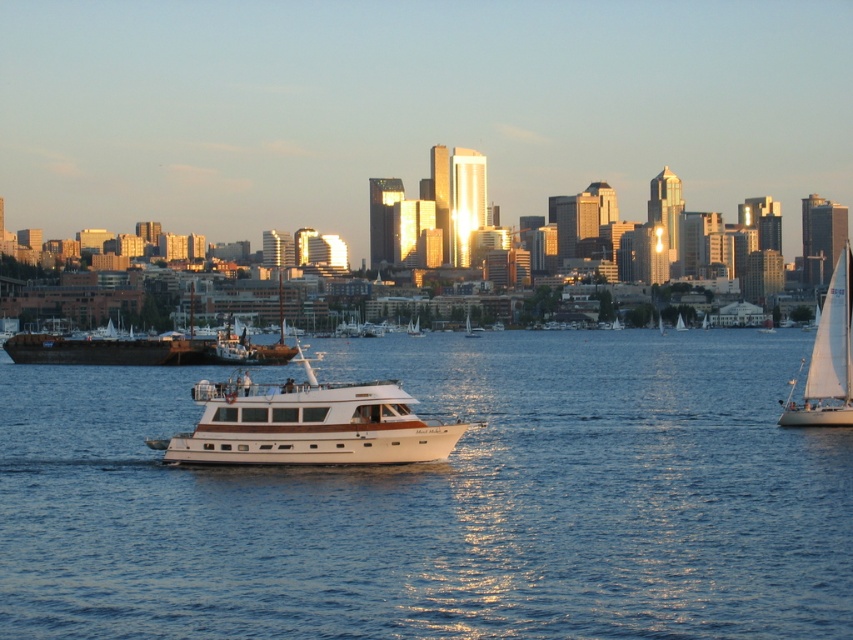
Who is more distant from viewer, (x=310, y=424) or (x=843, y=314)?

The point (x=843, y=314) is more distant.

Who is more forward, (297, 397) or (791, 424)?

Positioned in front is point (297, 397).

Is point (300, 362) less distant than point (809, 422)?

No, (300, 362) is further to viewer.

Where is `white polished wood boat at center`? The width and height of the screenshot is (853, 640). white polished wood boat at center is located at coordinates (308, 422).

Between blue water at center and white sailboat at center, which one is positioned higher?

white sailboat at center is above.

Is blue water at center taller than white sailboat at center?

Indeed, blue water at center has a greater height compared to white sailboat at center.

Which is in front, point (149, 484) or point (469, 332)?

Point (149, 484)

Find the location of a particular element. This screenshot has height=640, width=853. blue water at center is located at coordinates (440, 500).

Does white sailboat at right have a greater height compared to wooden sailboat at center?

Correct, white sailboat at right is much taller as wooden sailboat at center.

The image size is (853, 640). Find the location of `white sailboat at right`. white sailboat at right is located at coordinates (828, 358).

Which is in front, point (827, 292) or point (227, 355)?

Point (827, 292) is more forward.

What are the coordinates of `white sailboat at right` in the screenshot? It's located at (828, 358).